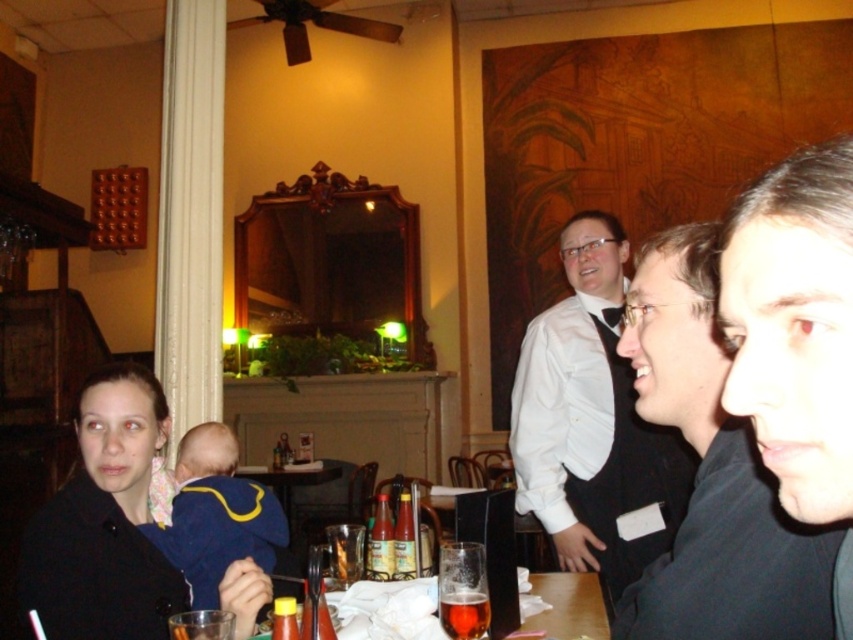
Based on the photo, measure the distance from black matte shirt at right to white shirt at upper center.

A distance of 34.24 inches exists between black matte shirt at right and white shirt at upper center.

Can you confirm if black matte shirt at right is thinner than white shirt at upper center?

Indeed, black matte shirt at right has a lesser width compared to white shirt at upper center.

Describe the element at coordinates (712, 474) in the screenshot. I see `black matte shirt at right` at that location.

Identify the location of black matte shirt at right. (712, 474).

Can you confirm if white shirt at upper center is shorter than amber glass beer at lower center?

No.

Between white shirt at upper center and amber glass beer at lower center, which one is positioned lower?

amber glass beer at lower center is below.

Between point (518, 358) and point (485, 593), which one is positioned behind?

Point (518, 358)

Identify the location of white shirt at upper center. (590, 419).

Consider the image. Does black matte shirt at right have a lesser height compared to amber glass beer at lower center?

Incorrect, black matte shirt at right's height does not fall short of amber glass beer at lower center's.

Does black matte shirt at right have a greater width compared to amber glass beer at lower center?

Correct, the width of black matte shirt at right exceeds that of amber glass beer at lower center.

Between point (677, 294) and point (473, 605), which one is positioned in front?

Point (677, 294) is more forward.

Where is `black matte shirt at right`? The image size is (853, 640). black matte shirt at right is located at coordinates (712, 474).